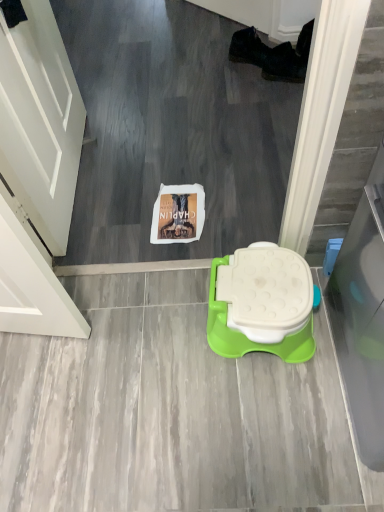
What do you see at coordinates (40, 121) in the screenshot? Image resolution: width=384 pixels, height=512 pixels. I see `white matte door at upper left` at bounding box center [40, 121].

Where is `white matte door at upper left`? white matte door at upper left is located at coordinates (40, 121).

This screenshot has height=512, width=384. Describe the element at coordinates (261, 304) in the screenshot. I see `white plastic toilet at center` at that location.

Find the location of `white plastic toilet at center`. white plastic toilet at center is located at coordinates (261, 304).

I want to click on white matte door at upper left, so click(40, 121).

From the picture: Would you say white matte door at upper left is to the left or to the right of white plastic toilet at center in the picture?

In the image, white matte door at upper left appears on the left side of white plastic toilet at center.

Considering the relative positions of white matte door at upper left and white plastic toilet at center in the image provided, is white matte door at upper left in front of white plastic toilet at center?

Yes, it is in front of white plastic toilet at center.

Is point (58, 42) behind point (274, 293)?

That is True.

Based on the photo, from the image's perspective, is white matte door at upper left on top of white plastic toilet at center?

Yes, from the image's perspective, white matte door at upper left is over white plastic toilet at center.

From a real-world perspective, between white matte door at upper left and white plastic toilet at center, who is vertically higher?

In real-world perspective, white matte door at upper left is above.

Is white matte door at upper left wider or thinner than white plastic toilet at center?

Clearly, white matte door at upper left has less width compared to white plastic toilet at center.

Can you confirm if white matte door at upper left is shorter than white plastic toilet at center?

In fact, white matte door at upper left may be taller than white plastic toilet at center.

Considering the sizes of objects white matte door at upper left and white plastic toilet at center in the image provided, who is bigger, white matte door at upper left or white plastic toilet at center?

white plastic toilet at center.

Which is correct: white matte door at upper left is inside white plastic toilet at center, or outside of it?

white matte door at upper left is not enclosed by white plastic toilet at center.

Are white matte door at upper left and white plastic toilet at center located far from each other?

white matte door at upper left is near white plastic toilet at center, not far away.

Could you tell me if white matte door at upper left is facing white plastic toilet at center?

Yes.

What's the angular difference between white matte door at upper left and white plastic toilet at center's facing directions?

The angle between the facing direction of white matte door at upper left and the facing direction of white plastic toilet at center is 174 degrees.

How much distance is there between white matte door at upper left and white plastic toilet at center?

A distance of 30.32 inches exists between white matte door at upper left and white plastic toilet at center.

Where is `toilet that is on the right side of white matte door at upper left`? The height and width of the screenshot is (512, 384). toilet that is on the right side of white matte door at upper left is located at coordinates (261, 304).

Can you confirm if white plastic toilet at center is positioned to the left of white matte door at upper left?

In fact, white plastic toilet at center is to the right of white matte door at upper left.

Considering the positions of objects white plastic toilet at center and white matte door at upper left in the image provided, who is behind, white plastic toilet at center or white matte door at upper left?

white plastic toilet at center is more distant.

Does point (234, 304) come farther from viewer compared to point (51, 234)?

No, (234, 304) is closer to viewer.

From the image's perspective, is white plastic toilet at center on white matte door at upper left?

Incorrect, from the image's perspective, white plastic toilet at center is lower than white matte door at upper left.

From a real-world perspective, who is located lower, white plastic toilet at center or white matte door at upper left?

In real-world perspective, white plastic toilet at center is lower.

Is white plastic toilet at center thinner than white matte door at upper left?

Incorrect, the width of white plastic toilet at center is not less than that of white matte door at upper left.

Does white plastic toilet at center have a lesser height compared to white matte door at upper left?

Indeed, white plastic toilet at center has a lesser height compared to white matte door at upper left.

Who is smaller, white plastic toilet at center or white matte door at upper left?

Smaller between the two is white matte door at upper left.

Do you think white plastic toilet at center is within white matte door at upper left, or outside of it?

white plastic toilet at center exists outside the volume of white matte door at upper left.

Is white plastic toilet at center not close to white matte door at upper left?

Actually, white plastic toilet at center and white matte door at upper left are a little close together.

Is white matte door at upper left at the back of white plastic toilet at center?

No.

How many degrees apart are the facing directions of white plastic toilet at center and white matte door at upper left?

The angular difference between white plastic toilet at center and white matte door at upper left is 174 degrees.

Measure the distance from white plastic toilet at center to white matte door at upper left.

30.32 inches.

Find the location of a particular element. This screenshot has height=512, width=384. door located above the white plastic toilet at center (from the image's perspective) is located at coordinates (40, 121).

The height and width of the screenshot is (512, 384). In the image, there is a white matte door at upper left. In order to click on toilet below it (from a real-world perspective) in this screenshot , I will do `click(261, 304)`.

The image size is (384, 512). I want to click on door in front of the white plastic toilet at center, so click(40, 121).